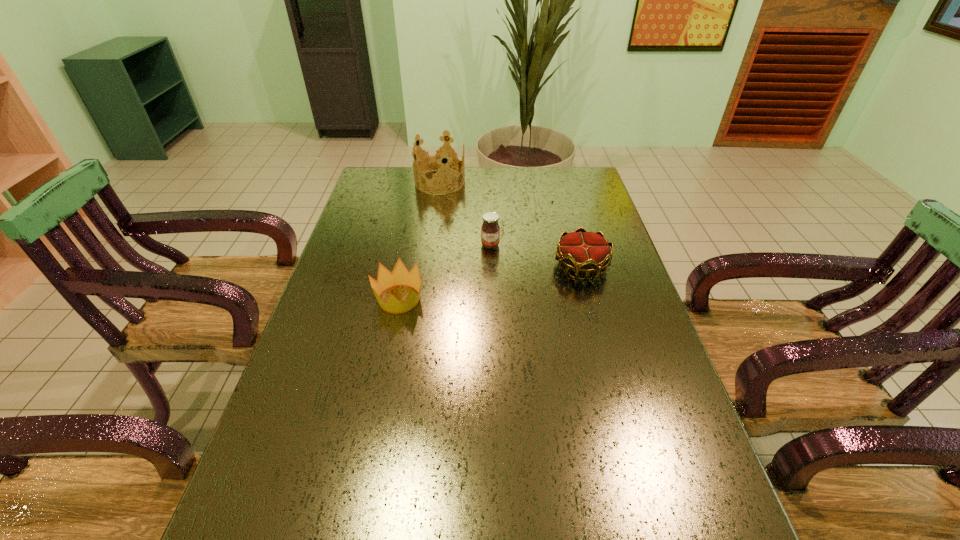
You are a GUI agent. You are given a task and a screenshot of the screen. Output one action in this format:
    pyautogui.click(x=<x>, y=<y>)
    Task: Click on the object that is at the right edge
    This screenshot has width=960, height=540.
    Given the screenshot: What is the action you would take?
    pyautogui.click(x=587, y=252)

The height and width of the screenshot is (540, 960). I want to click on vacant area at the far edge of the desktop, so click(447, 194).

In order to click on blank space at the left edge of the desktop in this screenshot , I will do `click(361, 200)`.

Locate an element on the screen. This screenshot has width=960, height=540. free space at the right edge is located at coordinates (609, 240).

This screenshot has height=540, width=960. Identify the location of free space at the far left corner. (399, 172).

The width and height of the screenshot is (960, 540). In order to click on free space at the far right corner of the desktop in this screenshot , I will do `click(579, 176)`.

Locate an element on the screen. empty space between the rightmost object and the tallest object is located at coordinates 511,224.

Locate which object ranks third in proximity to the rightmost object. Please provide its 2D coordinates. Your answer should be formatted as a tuple, i.e. [(x, y)], where the tuple contains the x and y coordinates of a point satisfying the conditions above.

[(438, 161)]

Where is `object that stands as the closest to the jam`? The width and height of the screenshot is (960, 540). object that stands as the closest to the jam is located at coordinates (587, 252).

The width and height of the screenshot is (960, 540). I want to click on crown that can be found as the second closest to the rightmost object, so click(x=438, y=161).